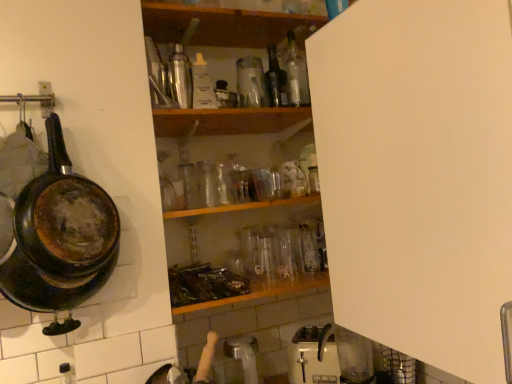
This screenshot has height=384, width=512. What do you see at coordinates (251, 83) in the screenshot?
I see `transparent glass bottle at upper center, which appears as the fifth bottle when viewed from the left` at bounding box center [251, 83].

Describe the element at coordinates (67, 373) in the screenshot. I see `translucent glass bottle at lower left, acting as the seventh bottle starting from the top` at that location.

This screenshot has height=384, width=512. In order to click on white matte cabinet at upper right in this screenshot , I will do pos(418,175).

Locate an element on the screen. This screenshot has height=384, width=512. white plastic toaster at lower center is located at coordinates (313, 358).

Who is more distant, white plastic toaster at lower center or transparent glass bottle at upper center, the 3th bottle in the right-to-left sequence?

white plastic toaster at lower center is further away from the camera.

Is white plastic toaster at lower center at the left side of transparent glass bottle at upper center, placed as the 3th bottle when sorted from top to bottom?

No, white plastic toaster at lower center is not to the left of transparent glass bottle at upper center, placed as the 3th bottle when sorted from top to bottom.

Could you tell me if white plastic toaster at lower center is turned towards transparent glass bottle at upper center, which appears as the fifth bottle when viewed from the left?

No, white plastic toaster at lower center is not facing towards transparent glass bottle at upper center, which appears as the fifth bottle when viewed from the left.

Based on the photo, does white plastic toaster at lower center have a greater height compared to transparent glass bottle at upper center, the 3th bottle in the right-to-left sequence?

In fact, white plastic toaster at lower center may be shorter than transparent glass bottle at upper center, the 3th bottle in the right-to-left sequence.

Does clear plastic bottle at center, the 5th bottle when ordered from right to left, appear on the left side of transparent glass bottle at center, which ranks as the 4th bottle in right-to-left order?

Answer: Indeed, clear plastic bottle at center, the 5th bottle when ordered from right to left, is positioned on the left side of transparent glass bottle at center, which ranks as the 4th bottle in right-to-left order.

Can you tell me how much clear plastic bottle at center, the 3th bottle ordered from the bottom, and transparent glass bottle at center, which ranks as the 4th bottle in right-to-left order, differ in facing direction?

6.22 degrees separate the facing orientations of clear plastic bottle at center, the 3th bottle ordered from the bottom, and transparent glass bottle at center, which ranks as the 4th bottle in right-to-left order.

Is transparent glass bottle at center, acting as the 4th bottle starting from the left, at the back of clear plastic bottle at center, which is the 5th bottle in top-to-bottom order?

That's not correct — clear plastic bottle at center, which is the 5th bottle in top-to-bottom order, is not looking away from transparent glass bottle at center, acting as the 4th bottle starting from the left.

Measure the distance from clear plastic bottle at center, which is counted as the third bottle, starting from the left, to transparent glass bottle at center, acting as the 4th bottle starting from the left.

clear plastic bottle at center, which is counted as the third bottle, starting from the left, and transparent glass bottle at center, acting as the 4th bottle starting from the left, are 11.88 inches apart.

Does translucent glass bottle at lower left, the first bottle in the bottom-to-top sequence, turn towards transparent glass bottle at upper center, which ranks as the 5th bottle in bottom-to-top order?

No, translucent glass bottle at lower left, the first bottle in the bottom-to-top sequence, is not aimed at transparent glass bottle at upper center, which ranks as the 5th bottle in bottom-to-top order.

Identify the location of the 1st bottle in front when counting from the transparent glass bottle at upper center, the 3th bottle in the right-to-left sequence. (67, 373).

Is translucent glass bottle at lower left, the 1th bottle in the left-to-right sequence, not within transparent glass bottle at upper center, placed as the 3th bottle when sorted from top to bottom?

Indeed, translucent glass bottle at lower left, the 1th bottle in the left-to-right sequence, is completely outside transparent glass bottle at upper center, placed as the 3th bottle when sorted from top to bottom.

You are a GUI agent. You are given a task and a screenshot of the screen. Output one action in this format:
    pyautogui.click(x=<x>, y=<y>)
    Task: Click on the bottle that is the 2nd one when counting rightward from the clear plastic bottle at center, which is counted as the third bottle, starting from the left
    
    Given the screenshot: What is the action you would take?
    pyautogui.click(x=251, y=83)

From the image's perspective, is transparent glass bottle at upper center, the 3th bottle in the right-to-left sequence, located above or below clear plastic bottle at center, the 3th bottle ordered from the bottom?

transparent glass bottle at upper center, the 3th bottle in the right-to-left sequence, is above clear plastic bottle at center, the 3th bottle ordered from the bottom.

Does transparent glass bottle at upper center, which appears as the fifth bottle when viewed from the left, have a smaller size compared to clear plastic bottle at center, which is counted as the third bottle, starting from the left?

Actually, transparent glass bottle at upper center, which appears as the fifth bottle when viewed from the left, might be larger than clear plastic bottle at center, which is counted as the third bottle, starting from the left.

Measure the distance from transparent glass bottle at upper center, which appears as the fifth bottle when viewed from the left, to clear plastic bottle at center, which is the 5th bottle in top-to-bottom order.

7.36 inches.

From the picture: From a real-world perspective, is translucent glass bottle at lower left, the 1th bottle in the left-to-right sequence, on top of brushed metal thermos at upper center, placed as the sixth bottle when sorted from right to left?

Actually, translucent glass bottle at lower left, the 1th bottle in the left-to-right sequence, is physically below brushed metal thermos at upper center, placed as the sixth bottle when sorted from right to left, in the real world.

In terms of width, does translucent glass bottle at lower left, arranged as the seventh bottle when viewed from the right, look wider or thinner when compared to brushed metal thermos at upper center, placed as the sixth bottle when sorted from right to left?

Considering their sizes, translucent glass bottle at lower left, arranged as the seventh bottle when viewed from the right, looks slimmer than brushed metal thermos at upper center, placed as the sixth bottle when sorted from right to left.

Is translucent glass bottle at lower left, the first bottle in the bottom-to-top sequence, further to the viewer compared to brushed metal thermos at upper center, placed as the sixth bottle when sorted from right to left?

That is True.

Considering the relative sizes of translucent glass bottle at lower left, the first bottle in the bottom-to-top sequence, and brushed metal thermos at upper center, which ranks as the 4th bottle in bottom-to-top order, in the image provided, is translucent glass bottle at lower left, the first bottle in the bottom-to-top sequence, smaller than brushed metal thermos at upper center, which ranks as the 4th bottle in bottom-to-top order,?

Correct, translucent glass bottle at lower left, the first bottle in the bottom-to-top sequence, occupies less space than brushed metal thermos at upper center, which ranks as the 4th bottle in bottom-to-top order.

Is point (298, 84) closer or farther from the camera than point (181, 77)?

Point (298, 84).

Is brushed metal thermos at upper center, placed as the sixth bottle when sorted from right to left, completely or partially inside transparent glass bottle at upper center, which is counted as the seventh bottle, starting from the bottom?

Actually, brushed metal thermos at upper center, placed as the sixth bottle when sorted from right to left, is outside transparent glass bottle at upper center, which is counted as the seventh bottle, starting from the bottom.

Is transparent glass bottle at upper center, which is counted as the seventh bottle, starting from the bottom, thinner than brushed metal thermos at upper center, the 4th bottle viewed from the top?

Correct, the width of transparent glass bottle at upper center, which is counted as the seventh bottle, starting from the bottom, is less than that of brushed metal thermos at upper center, the 4th bottle viewed from the top.

Is transparent glass bottle at upper center, which is the first bottle in top-to-bottom order, turned away from brushed metal thermos at upper center, placed as the sixth bottle when sorted from right to left?

No, transparent glass bottle at upper center, which is the first bottle in top-to-bottom order, is not facing away from brushed metal thermos at upper center, placed as the sixth bottle when sorted from right to left.

Locate an element on the screen. The height and width of the screenshot is (384, 512). appliance below the transparent glass bottle at center, which is the 6th bottle from top to bottom (from a real-world perspective) is located at coordinates (313, 358).

Is transparent glass bottle at center, which is the 6th bottle from top to bottom, to the left of white plastic toaster at lower center from the viewer's perspective?

Yes.

Is the surface of transparent glass bottle at center, marked as the 2th bottle in a bottom-to-top arrangement, in direct contact with white plastic toaster at lower center?

transparent glass bottle at center, marked as the 2th bottle in a bottom-to-top arrangement, and white plastic toaster at lower center are clearly separated.

Between point (211, 197) and point (333, 341), which one is positioned behind?

The point (333, 341) is more distant.

Locate an element on the screen. bottle that is the 4th one above the white plastic toaster at lower center (from a real-world perspective) is located at coordinates (251, 83).

From a real-world perspective, which bottle is the 1st one underneath the clear plastic bottle at center, which is counted as the third bottle, starting from the left? Please provide its 2D coordinates.

[(208, 183)]

From the image, which object appears to be nearer to transparent glass bottle at center, marked as the 2th bottle in a bottom-to-top arrangement, transparent glass bottle at upper center, which is counted as the seventh bottle, starting from the bottom, or rusty cast iron frying pan at left?

The object closer to transparent glass bottle at center, marked as the 2th bottle in a bottom-to-top arrangement, is transparent glass bottle at upper center, which is counted as the seventh bottle, starting from the bottom.

Considering their positions, is transparent glass bottle at center, which ranks as the 4th bottle in right-to-left order, positioned closer to white matte cabinet at upper right than white plastic toaster at lower center?

Based on the image, white plastic toaster at lower center appears to be nearer to white matte cabinet at upper right.

Considering their positions, is transparent glass bottle at center, acting as the 4th bottle starting from the left, positioned closer to white plastic toaster at lower center than brushed metal thermos at upper center, which ranks as the 4th bottle in bottom-to-top order?

transparent glass bottle at center, acting as the 4th bottle starting from the left, lies closer to white plastic toaster at lower center than the other object.

When comparing their distances from white matte cabinet at upper right, does transparent glass bottle at upper center, which appears as the fifth bottle when viewed from the left, or white plastic toaster at lower center seem closer?

Based on the image, white plastic toaster at lower center appears to be nearer to white matte cabinet at upper right.

Looking at the image, which one is located further to rusty cast iron frying pan at left, transparent glass bottle at center, which ranks as the 4th bottle in right-to-left order, or transparent glass bottle at upper center, which is the first bottle in top-to-bottom order?

transparent glass bottle at upper center, which is the first bottle in top-to-bottom order, is positioned further to the anchor rusty cast iron frying pan at left.

Based on their spatial positions, is brushed metal thermos at upper center, placed as the sixth bottle when sorted from right to left, or transparent glass bottle at upper center, the 3th bottle in the right-to-left sequence, further from rusty cast iron frying pan at left?

transparent glass bottle at upper center, the 3th bottle in the right-to-left sequence, is positioned further to the anchor rusty cast iron frying pan at left.

Looking at the image, which one is located closer to transparent glass bottle at upper center, which is counted as the seventh bottle, starting from the bottom, translucent glass bottle at center, placed as the 6th bottle when sorted from left to right, or white matte cabinet at upper right?

The object closer to transparent glass bottle at upper center, which is counted as the seventh bottle, starting from the bottom, is translucent glass bottle at center, placed as the 6th bottle when sorted from left to right.

Based on the photo, looking at the image, which one is located closer to clear plastic bottle at center, which is the 5th bottle in top-to-bottom order, white matte cabinet at upper right or rusty cast iron frying pan at left?

Based on the image, rusty cast iron frying pan at left appears to be nearer to clear plastic bottle at center, which is the 5th bottle in top-to-bottom order.

I want to click on side between transparent glass bottle at upper center, which appears as the fifth bottle when viewed from the left, and white plastic toaster at lower center from top to bottom, so click(418, 175).

Locate an element on the screen. This screenshot has width=512, height=384. side that lies between transparent glass bottle at upper center, placed as the 3th bottle when sorted from top to bottom, and translucent glass bottle at lower left, arranged as the seventh bottle when viewed from the right, from top to bottom is located at coordinates (418, 175).

You are a GUI agent. You are given a task and a screenshot of the screen. Output one action in this format:
    pyautogui.click(x=<x>, y=<y>)
    Task: Click on the bottle between clear plastic bottle at center, the 5th bottle when ordered from right to left, and white plastic toaster at lower center vertically
    The width and height of the screenshot is (512, 384).
    Given the screenshot: What is the action you would take?
    pyautogui.click(x=208, y=183)

I want to click on frying pan between transparent glass bottle at upper center, which is the first bottle in top-to-bottom order, and white plastic toaster at lower center from top to bottom, so click(x=60, y=236).